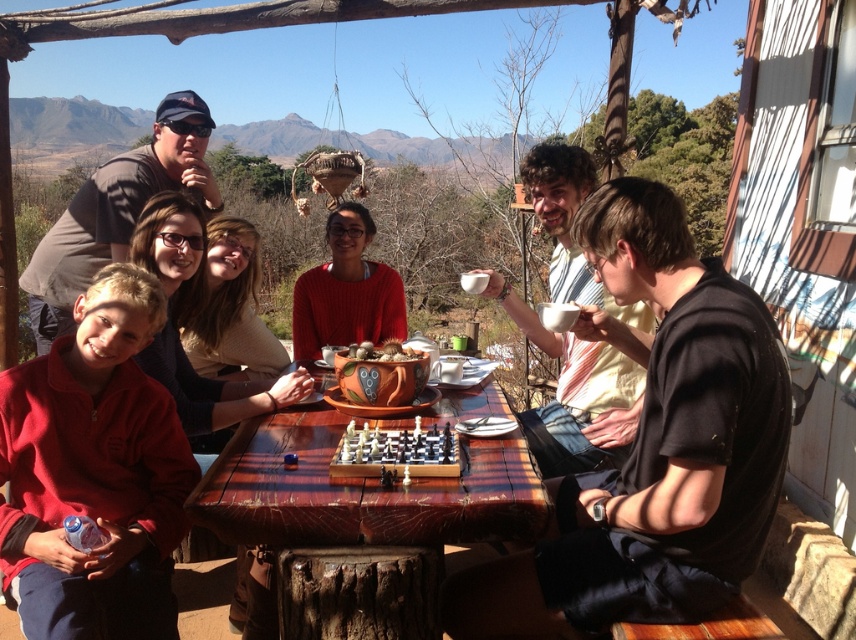
You are a guest at this gathering and want to place a small book on the table. The book is 2 inches thick. Considering the wooden chess set at center and the smooth clay pot at center, which object should you place the book next to to ensure it doesn

The wooden chess set at center is taller than the smooth clay pot at center. Since the book is only 2 inches thick, placing it next to the shorter smooth clay pot at center would prevent it from being knocked over by the taller chess set.

You are sitting at the wooden table and want to place a drink between the matte red sweater at center and the wooden chess set at center. Which object should you move to make space?

The matte red sweater at center is positioned on the left side of the wooden chess set at center, so you should move the matte red sweater at center to the left to make space for the drink.